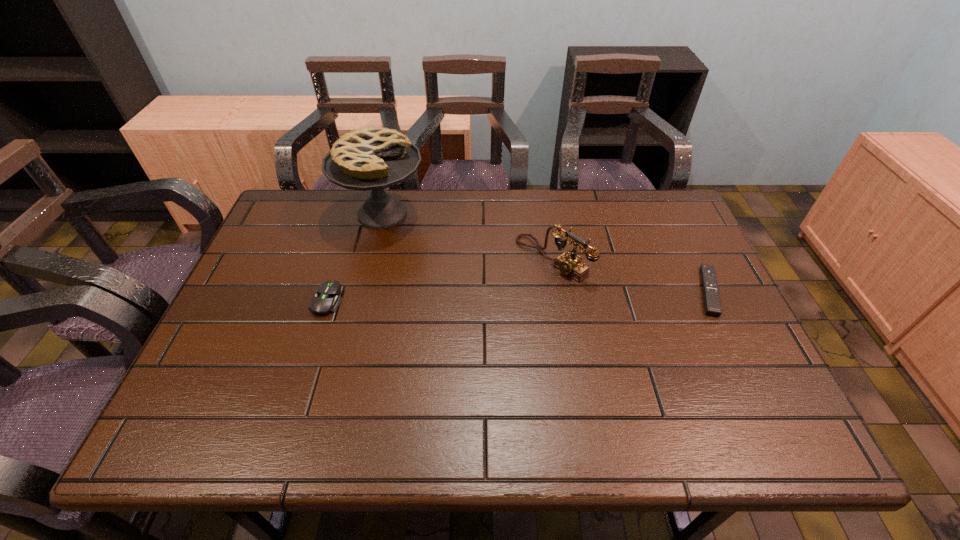
Locate an element on the screen. This screenshot has height=540, width=960. free space on the desktop that is between the computer mouse and the rightmost object and is positioned on the front-facing side of the third shortest object is located at coordinates [x=501, y=295].

Find the location of `vacant space on the desktop that is between the computer mouse and the rightmost object and is positioned on the cut side of the tallest object`. vacant space on the desktop that is between the computer mouse and the rightmost object and is positioned on the cut side of the tallest object is located at coordinates point(497,296).